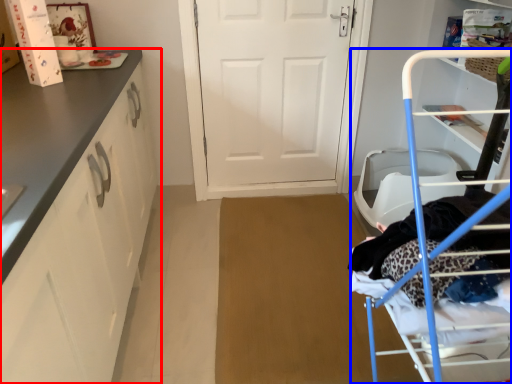
Question: Which of the following is the farthest to the observer, cabinetry (highlighted by a red box) or furniture (highlighted by a blue box)?

Choices:
 (A) cabinetry
 (B) furniture

Answer: (A)